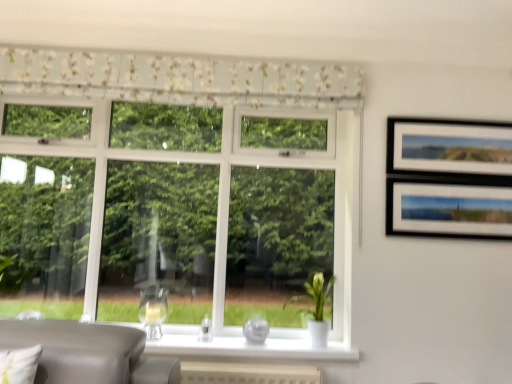
Question: From a real-world perspective, is white glossy vase at lower center above or below floral fabric valance at upper center?

Choices:
 (A) below
 (B) above

Answer: (A)

Question: Is white glossy vase at lower center bigger or smaller than floral fabric valance at upper center?

Choices:
 (A) big
 (B) small

Answer: (B)

Question: Which object is positioned farthest from the transparent glass vase at center?

Choices:
 (A) floral fabric valance at upper center
 (B) white glossy vase at lower center

Answer: (A)

Question: Based on their relative distances, which object is farther from the white glossy vase at lower center?

Choices:
 (A) floral fabric valance at upper center
 (B) transparent glass vase at center

Answer: (A)